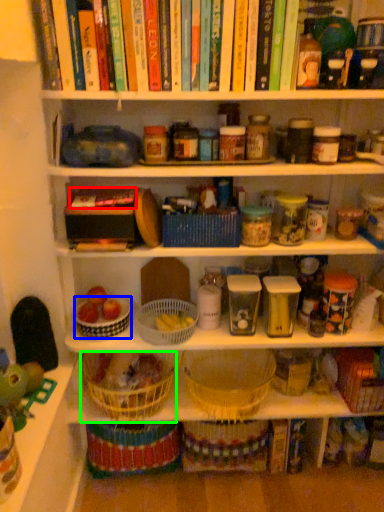
Question: Which is farther away from book (highlighted by a red box)? basket (highlighted by a blue box) or basket (highlighted by a green box)?

Choices:
 (A) basket
 (B) basket

Answer: (B)